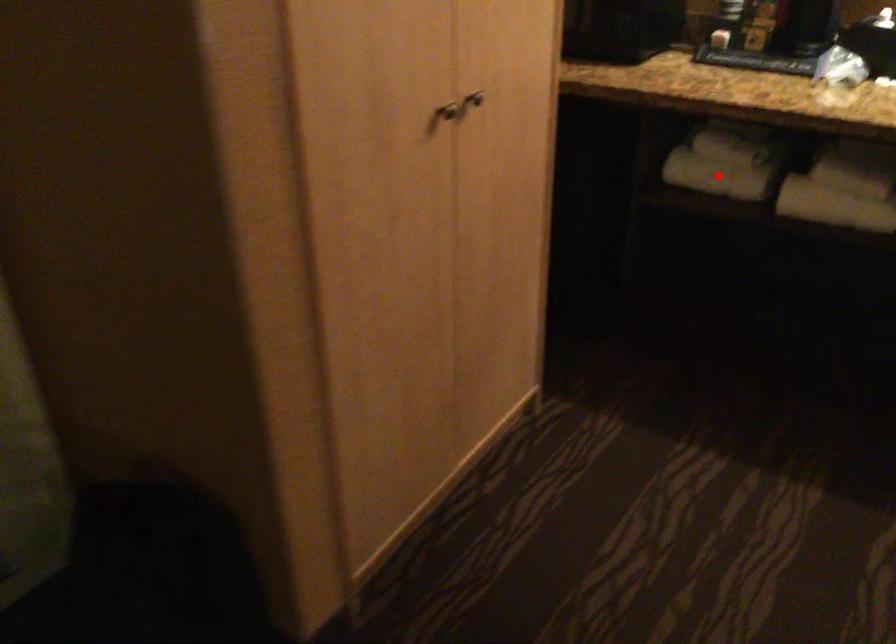
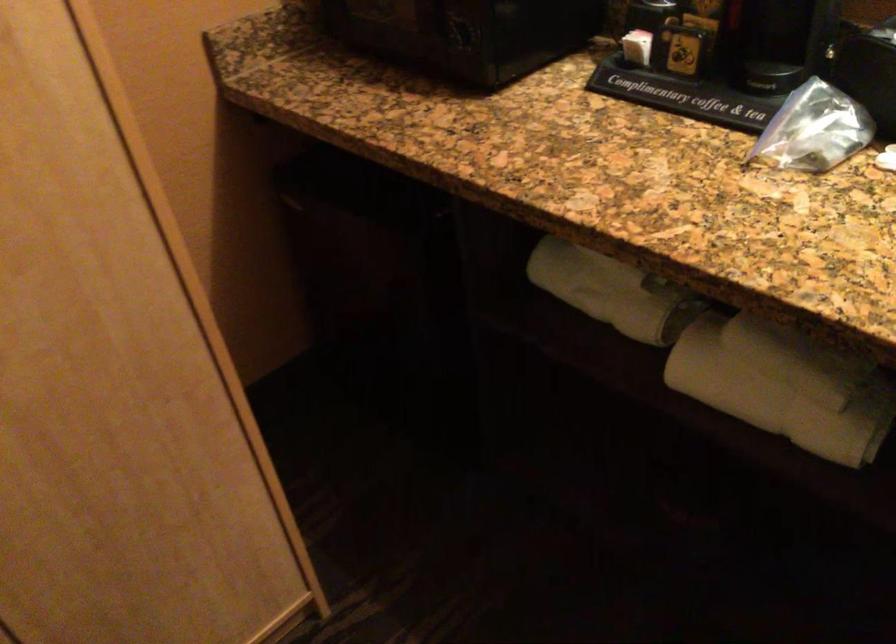
In the second image, find the point that corresponds to the highlighted location in the first image.

(596, 290)